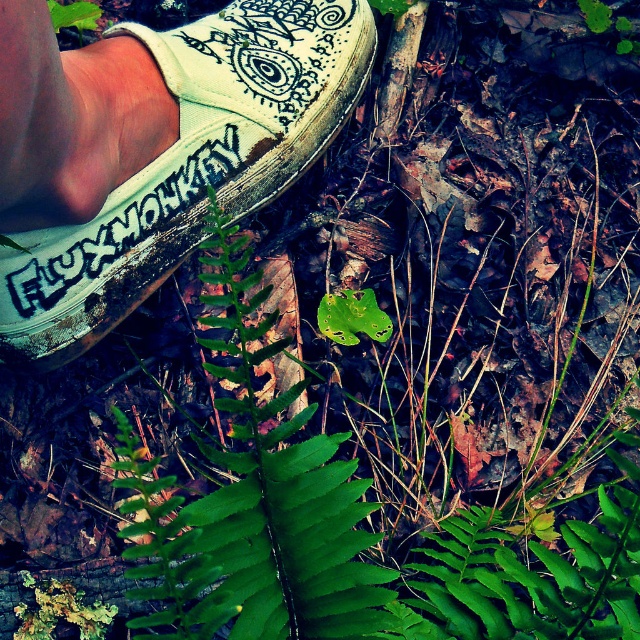
Question: Which point is farther to the camera?

Choices:
 (A) (141, 236)
 (B) (36, 352)
 (C) (212, 253)

Answer: (C)

Question: Considering the relative positions of white canvas shoe at center and green leafy fern at center in the image provided, where is white canvas shoe at center located with respect to green leafy fern at center?

Choices:
 (A) below
 (B) above

Answer: (B)

Question: Is green leafy fern at center behind black painted text at lower left?

Choices:
 (A) no
 (B) yes

Answer: (A)

Question: Which object is the farthest from the white canvas shoe at center?

Choices:
 (A) black painted text at lower left
 (B) green leafy fern at center

Answer: (B)

Question: Does green leafy fern at center come behind black painted text at lower left?

Choices:
 (A) no
 (B) yes

Answer: (A)

Question: Which of the following is the farthest from the observer?

Choices:
 (A) white canvas shoe at center
 (B) black painted text at lower left

Answer: (B)